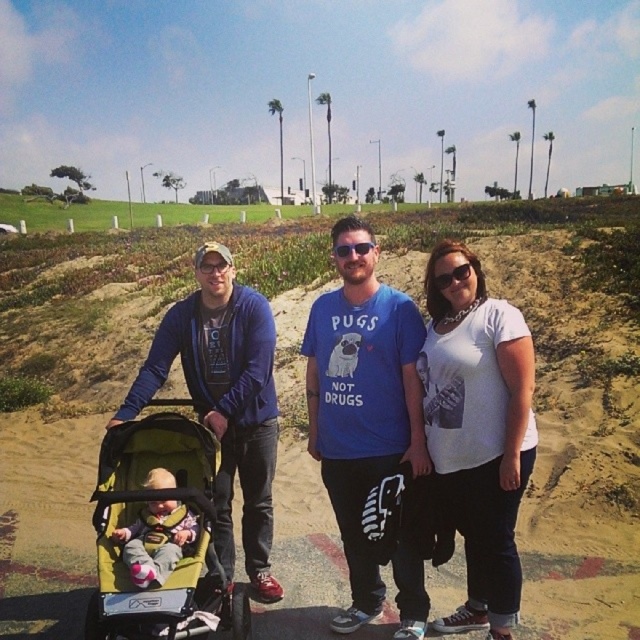
Does matte blue shirt at center appear on the right side of blue cotton t-shirt at center?

Correct, you'll find matte blue shirt at center to the right of blue cotton t-shirt at center.

Based on the photo, how distant is matte blue shirt at center from blue cotton t-shirt at center?

30.00 inches

Which is in front, point (355, 406) or point (314, 413)?

Point (355, 406) is more forward.

At what (x,y) coordinates should I click in order to perform the action: click on matte blue shirt at center. Please return your answer as a coordinate pair (x, y). Looking at the image, I should click on (420, 410).

Is white cotton shirt at center smaller than blue cotton t-shirt at center?

No.

Is white cotton shirt at center closer to camera compared to blue cotton t-shirt at center?

Yes, it is in front of blue cotton t-shirt at center.

Is point (493, 369) less distant than point (419, 625)?

Yes, point (493, 369) is closer to viewer.

Locate an element on the screen. This screenshot has height=640, width=640. white cotton shirt at center is located at coordinates (477, 429).

Who is shorter, blue cotton t-shirt at center or soft yellow fabric at center?

soft yellow fabric at center

Is blue cotton t-shirt at center bigger than soft yellow fabric at center?

Actually, blue cotton t-shirt at center might be smaller than soft yellow fabric at center.

Is point (401, 344) behind point (168, 548)?

Yes, point (401, 344) is behind point (168, 548).

This screenshot has width=640, height=640. What are the coordinates of `blue cotton t-shirt at center` in the screenshot? It's located at (362, 401).